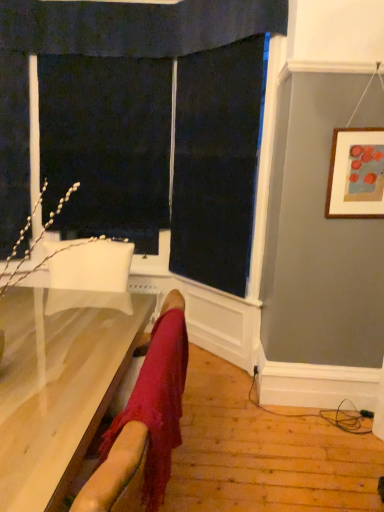
Question: Would you say wooden framed artwork at upper right is to the left or to the right of light wood table at lower left in the picture?

Choices:
 (A) right
 (B) left

Answer: (A)

Question: Is wooden framed artwork at upper right taller or shorter than light wood table at lower left?

Choices:
 (A) tall
 (B) short

Answer: (B)

Question: Which of these objects is positioned closest to the black fabric screen door at upper left?

Choices:
 (A) wooden framed artwork at upper right
 (B) light wood table at lower left

Answer: (A)

Question: Based on their relative distances, which object is nearer to the wooden framed artwork at upper right?

Choices:
 (A) light wood table at lower left
 (B) black fabric screen door at upper left

Answer: (A)